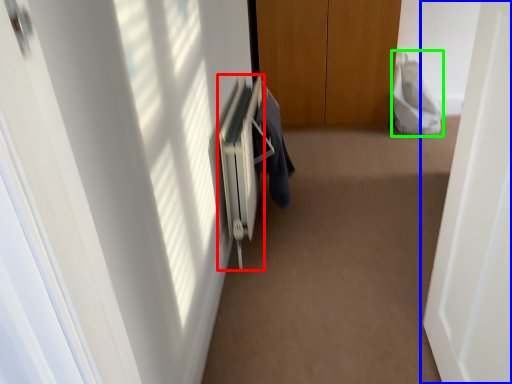
Question: Which object is the farthest from radiator (highlighted by a red box)? Choose among these: door (highlighted by a blue box) or robe (highlighted by a green box).

Choices:
 (A) door
 (B) robe

Answer: (B)